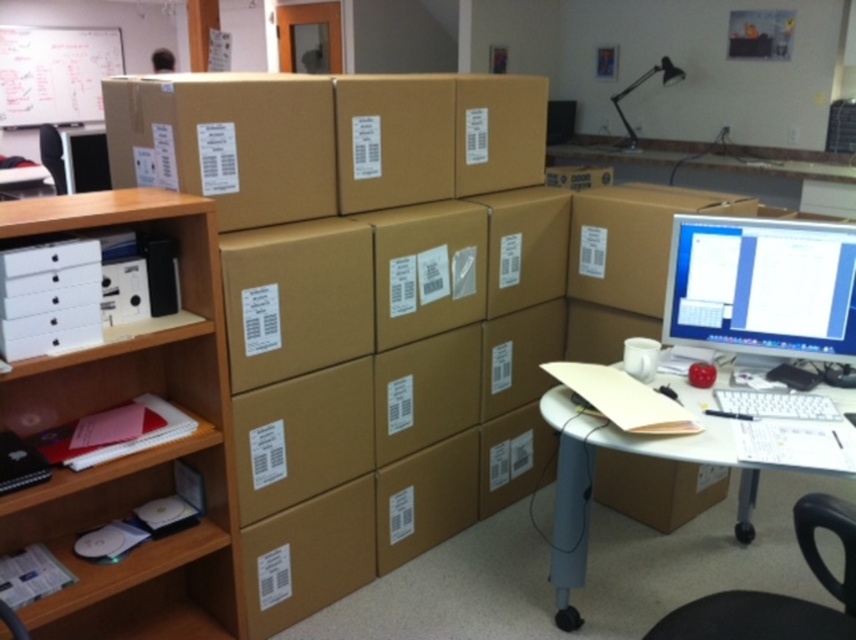
Question: Does matte black monitor at right have a larger size compared to matte brown desk at lower right?

Choices:
 (A) yes
 (B) no

Answer: (B)

Question: Which of these objects is positioned farthest from the black plastic swivel chair at lower right?

Choices:
 (A) matte brown desk at lower right
 (B) white cardboard bookshelf at left

Answer: (B)

Question: Is matte black monitor at right bigger than black plastic swivel chair at lower right?

Choices:
 (A) yes
 (B) no

Answer: (A)

Question: Which of these objects is positioned farthest from the matte black monitor at right?

Choices:
 (A) white cardboard bookshelf at left
 (B) matte brown desk at lower right
 (C) black plastic swivel chair at lower right

Answer: (A)

Question: Does white cardboard bookshelf at left have a larger size compared to matte brown desk at lower right?

Choices:
 (A) yes
 (B) no

Answer: (A)

Question: Among these points, which one is nearest to the camera?

Choices:
 (A) (690, 310)
 (B) (723, 602)
 (C) (568, 522)
 (D) (55, 212)

Answer: (B)